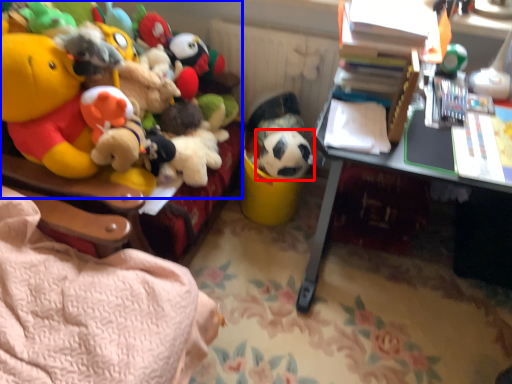
Question: Which object appears farthest to the camera in this image, toy (highlighted by a red box) or toy (highlighted by a blue box)?

Choices:
 (A) toy
 (B) toy

Answer: (A)